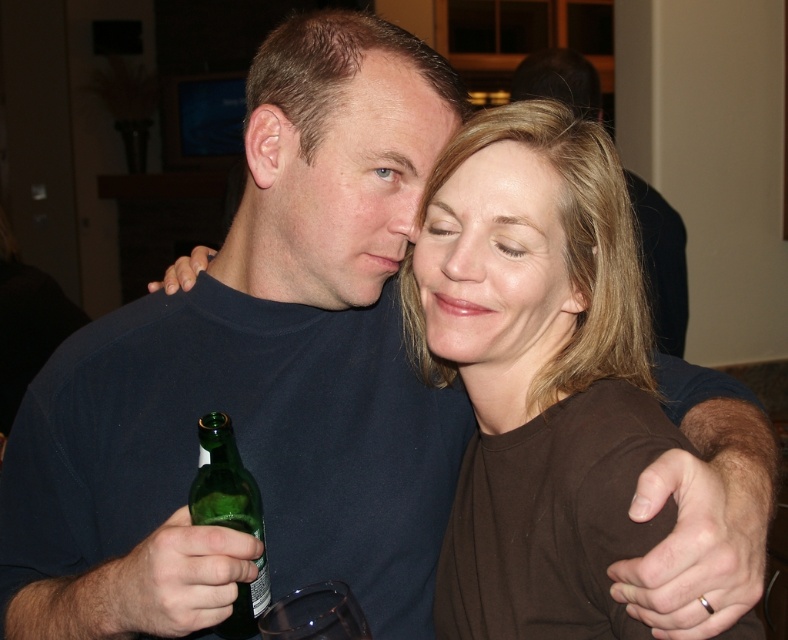
Question: Does smooth skin face at center have a lesser width compared to green glass bottle at lower left?

Choices:
 (A) no
 (B) yes

Answer: (A)

Question: Which is nearer to the smooth skin at center?

Choices:
 (A) smooth skin face at center
 (B) green glass bottle at lower left

Answer: (A)

Question: Where is brown matte shirt at center located in relation to transparent glass at lower center in the image?

Choices:
 (A) right
 (B) left

Answer: (A)

Question: Based on their relative distances, which object is nearer to the smooth skin at center?

Choices:
 (A) green glass bottle at lower left
 (B) smooth skin face at center

Answer: (B)

Question: Can you confirm if brown matte shirt at center is positioned above matte blue shirt at center?

Choices:
 (A) no
 (B) yes

Answer: (A)

Question: Which object is the farthest from the smooth skin at center?

Choices:
 (A) green glass bottle at lower left
 (B) transparent glass at lower center
 (C) matte blue shirt at center

Answer: (B)